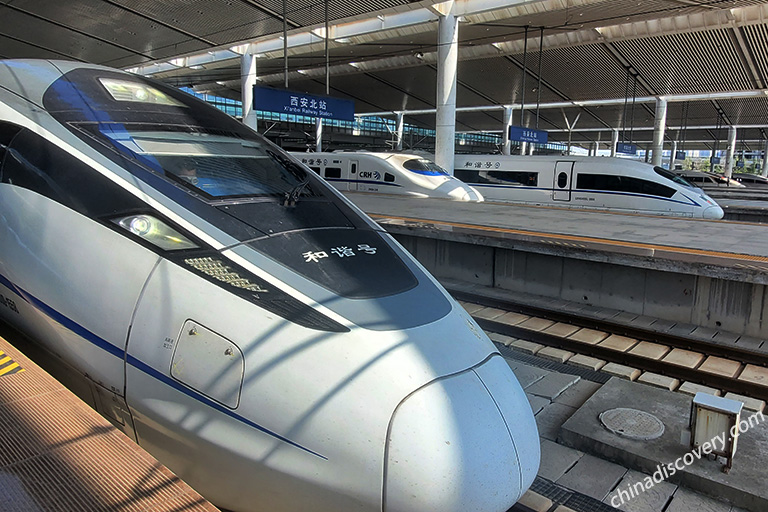
Locate an element on the screen. This screenshot has height=512, width=768. ceiling is located at coordinates (712, 60), (576, 74), (214, 12), (144, 26), (412, 82), (488, 75).